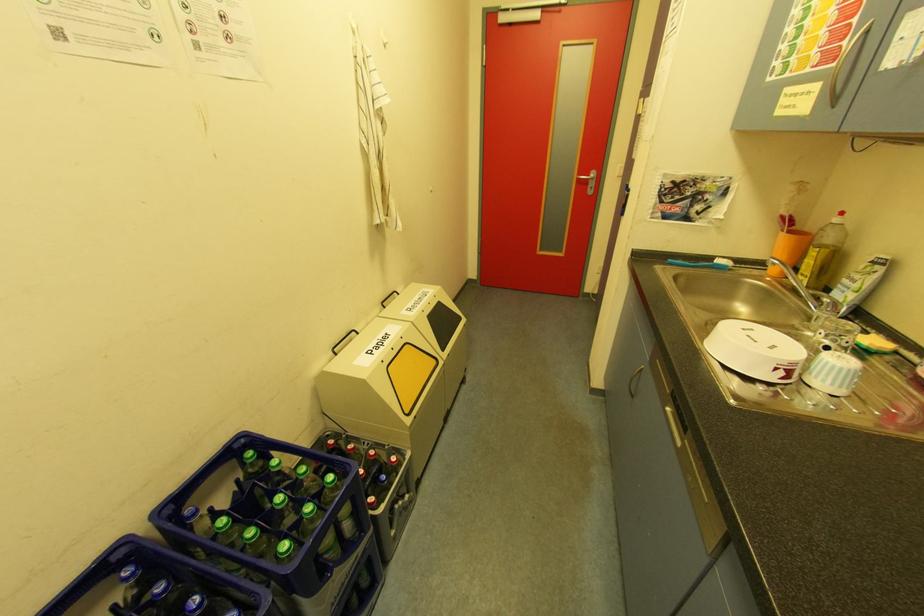
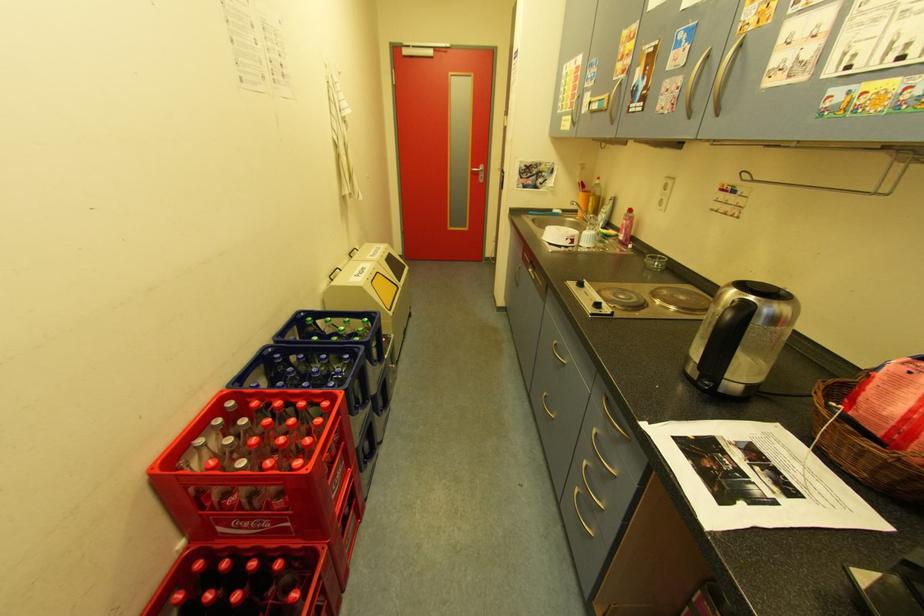
Which direction would the cameraman need to move to produce the second image?

The movement direction of the cameraman is left, backward.